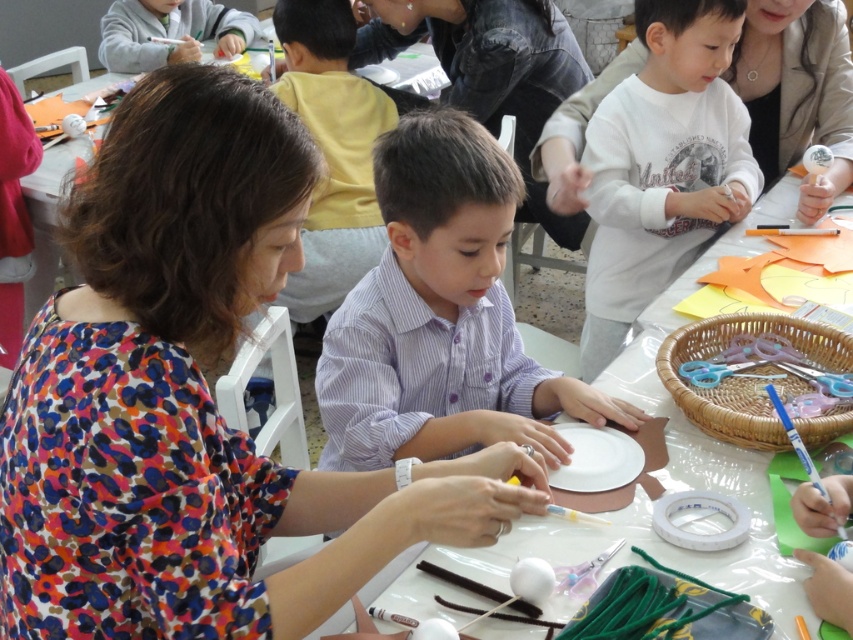
You are standing in front of the craft table and need to find the white cotton shirt at upper center. According to the coordinates provided, where should you look relative to the center of the image?

The white cotton shirt at upper center is located at coordinates point 0.258 on the x axis and 0.777 on the y axis, which is slightly to the left and above the center of the image.

You are a photographer trying to capture a clear shot of both the matte black shirt at upper center and the white matte shirt at upper right. Based on their positions, which one do you think will be easier to include in your frame without cropping?

The white matte shirt at upper right will be easier to include in the frame without cropping because it is shorter than the matte black shirt at upper center, making it less likely to be cut off by the frame edges.